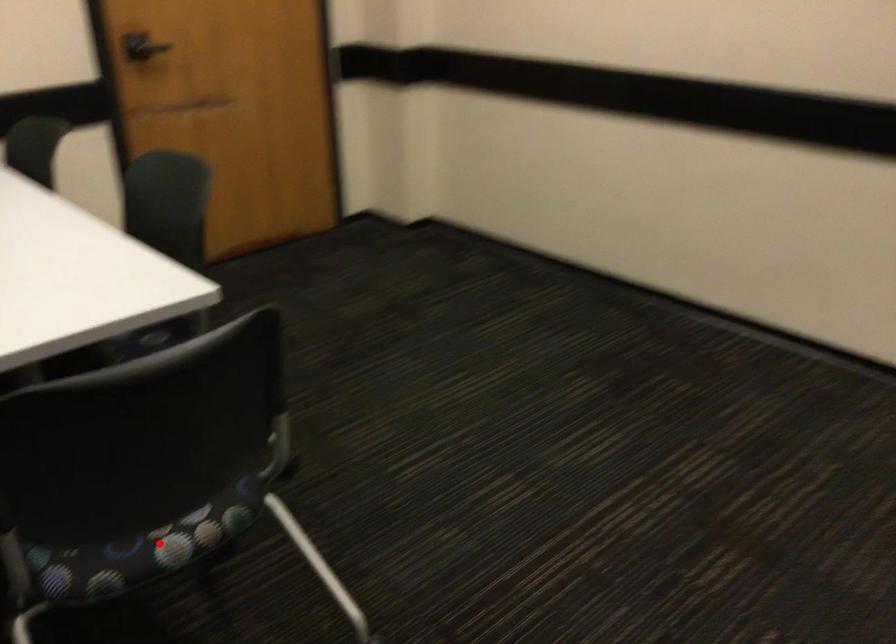
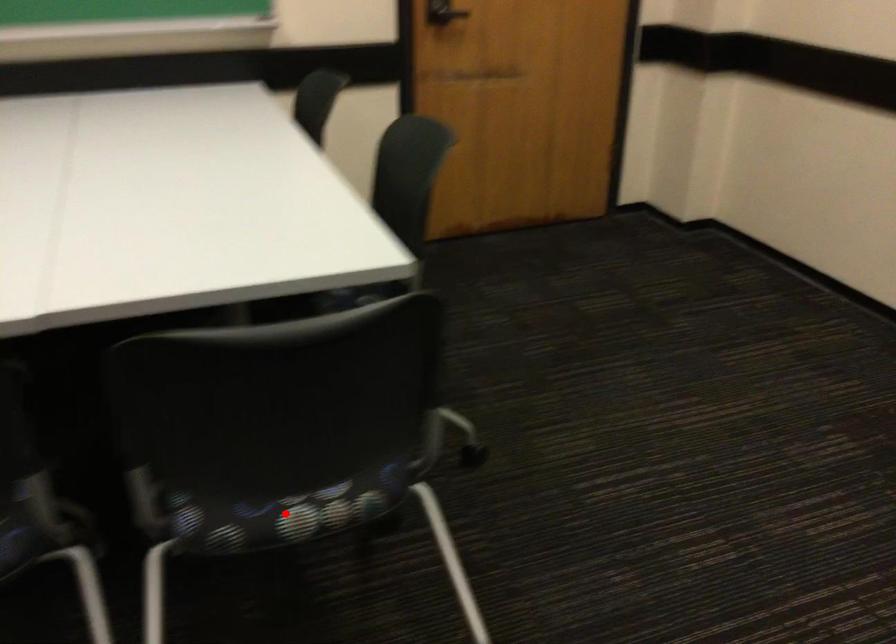
I am providing you with two images of the same scene from different viewpoints. A red point is marked on the first image and another point is marked on the second image. Does the point marked in image1 correspond to the same location as the one in image2?

Yes